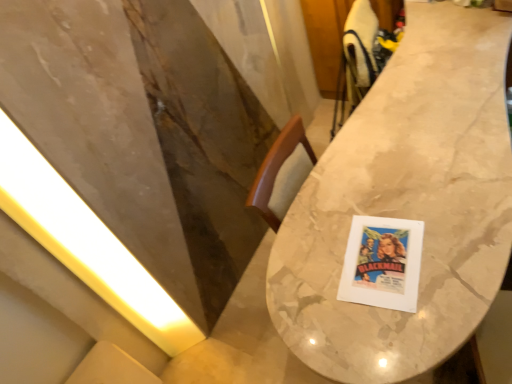
Identify the location of vacant region above marble table at center (from a real-world perspective). The image size is (512, 384). (428, 130).